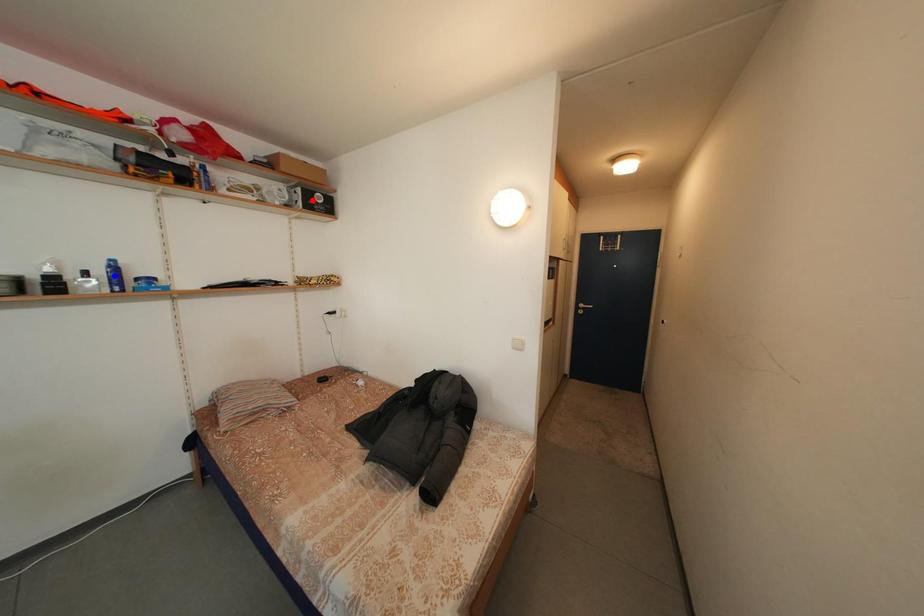
Question: Two points are marked on the image. Which point is closer to the camera?

Choices:
 (A) Blue point is closer.
 (B) Red point is closer.

Answer: (A)